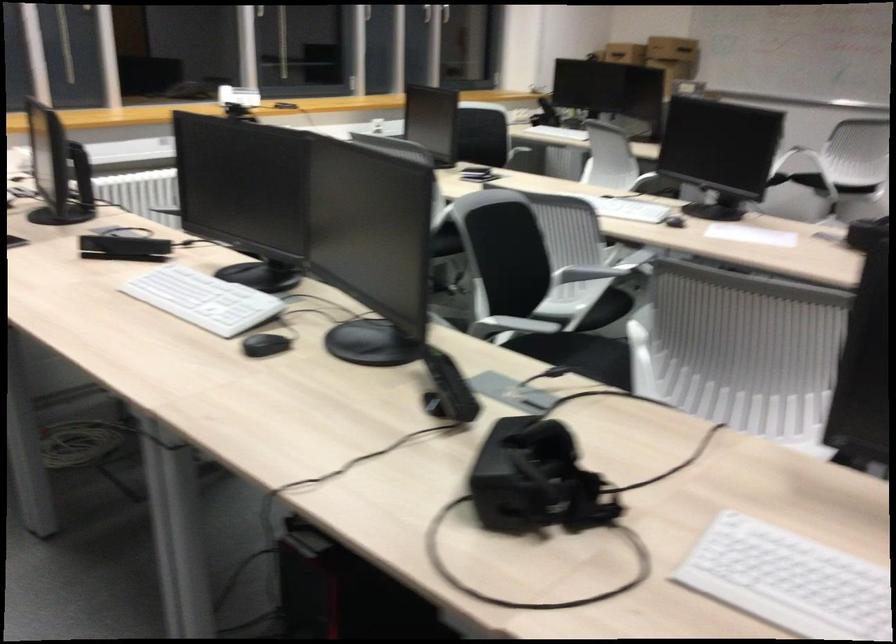
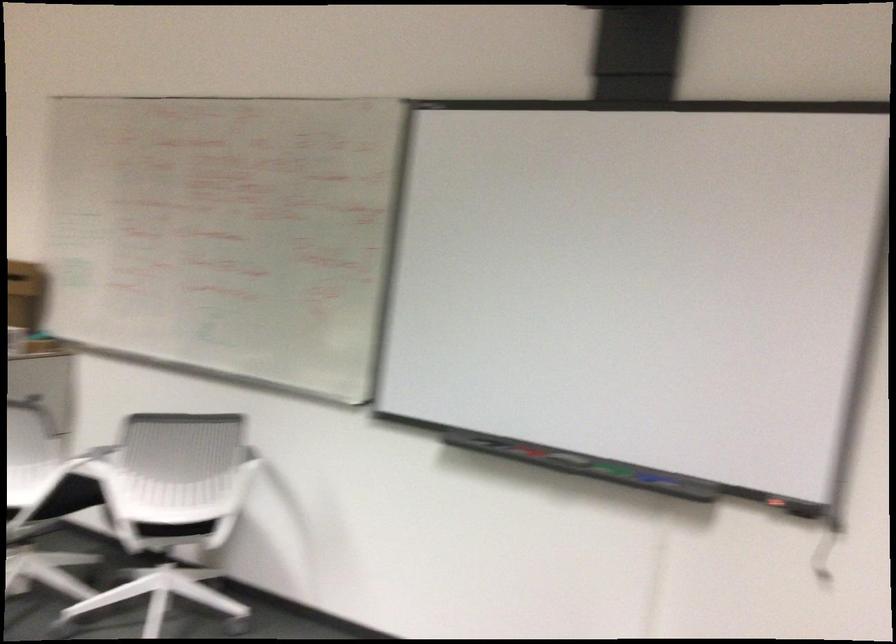
Find the pixel in the second image that matches point (824, 135) in the first image.

(95, 460)